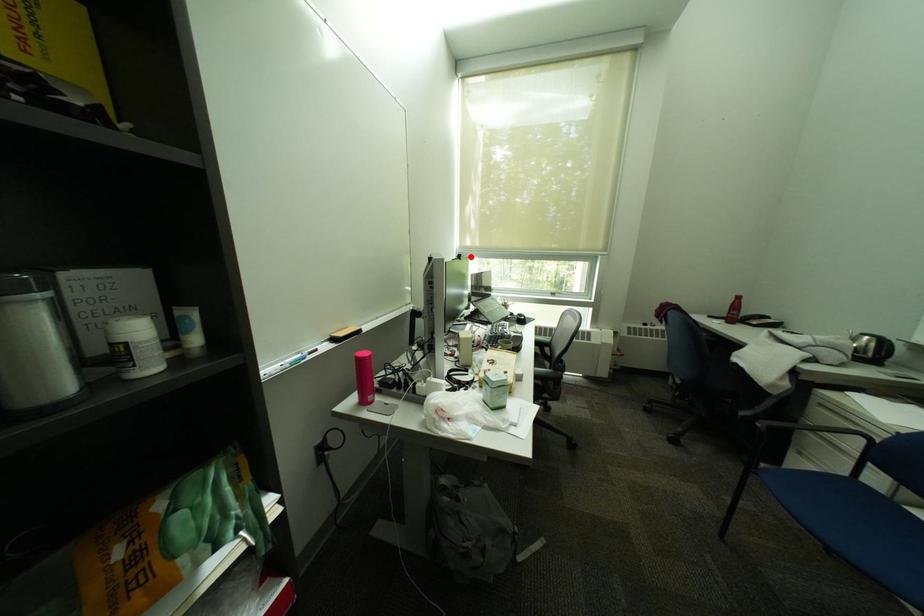
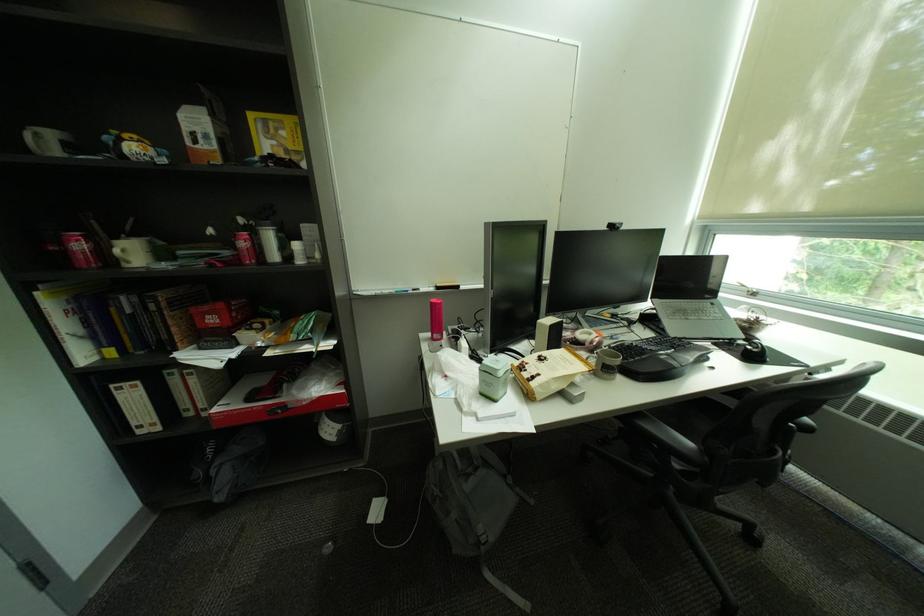
The point at the highlighted location is marked in the first image. Where is the corresponding point in the second image?

(621, 227)